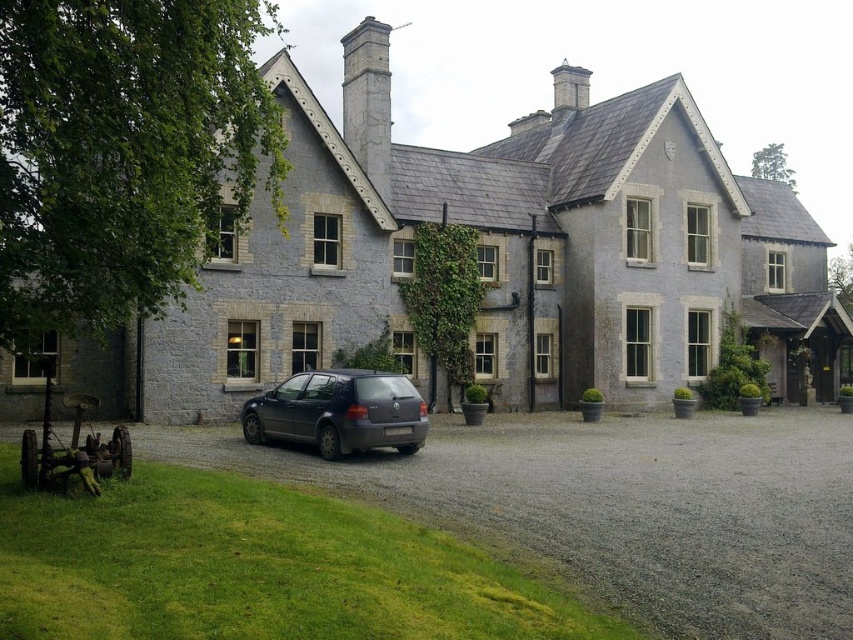
You are standing at the entrance of the traditional stone house and want to walk to the gray gravel driveway at lower center. According to the coordinates provided, what is the position of the driveway relative to your current location?

The gray gravel driveway at lower center is located at coordinates point (618, 506), which means it is positioned to the lower right of your current position at the entrance.

You are a delivery person arriving at the house and need to park your vehicle. The matte black car at center is blocking the gray gravel driveway at lower center. Can you drive around the car to access the driveway?

The gray gravel driveway at lower center is positioned under the matte black car at center, meaning the car is directly on top of the driveway. Therefore, you cannot drive around the car to access the driveway since the car is blocking the entrance entirely.